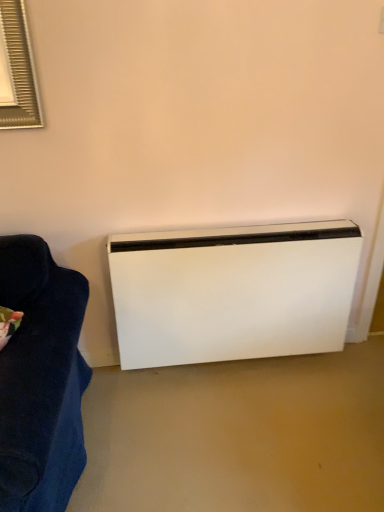
Question: From a real-world perspective, is white matte heater at lower right below dark blue fabric couch at left?

Choices:
 (A) no
 (B) yes

Answer: (B)

Question: Could you tell me if white matte heater at lower right is turned towards dark blue fabric couch at left?

Choices:
 (A) no
 (B) yes

Answer: (A)

Question: Considering the relative sizes of white matte heater at lower right and dark blue fabric couch at left in the image provided, is white matte heater at lower right taller than dark blue fabric couch at left?

Choices:
 (A) yes
 (B) no

Answer: (A)

Question: Is the surface of white matte heater at lower right in direct contact with dark blue fabric couch at left?

Choices:
 (A) no
 (B) yes

Answer: (A)

Question: Does white matte heater at lower right contain dark blue fabric couch at left?

Choices:
 (A) no
 (B) yes

Answer: (A)

Question: Is white matte heater at lower right looking in the opposite direction of dark blue fabric couch at left?

Choices:
 (A) no
 (B) yes

Answer: (A)

Question: Can you confirm if dark blue fabric couch at left is smaller than white matte heater at lower right?

Choices:
 (A) no
 (B) yes

Answer: (B)

Question: Does dark blue fabric couch at left come behind white matte heater at lower right?

Choices:
 (A) yes
 (B) no

Answer: (B)

Question: Could you tell me if dark blue fabric couch at left is facing white matte heater at lower right?

Choices:
 (A) yes
 (B) no

Answer: (B)

Question: Can you confirm if dark blue fabric couch at left is wider than white matte heater at lower right?

Choices:
 (A) yes
 (B) no

Answer: (A)

Question: Is dark blue fabric couch at left at the left side of white matte heater at lower right?

Choices:
 (A) no
 (B) yes

Answer: (B)

Question: Is dark blue fabric couch at left thinner than white matte heater at lower right?

Choices:
 (A) no
 (B) yes

Answer: (A)

Question: Based on their sizes in the image, would you say white matte heater at lower right is bigger or smaller than dark blue fabric couch at left?

Choices:
 (A) big
 (B) small

Answer: (A)